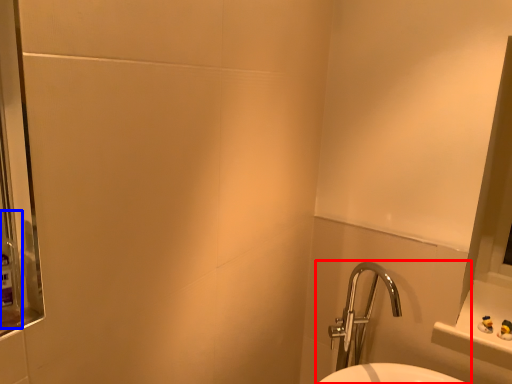
Question: Which object is further to the camera taking this photo, sink (highlighted by a red box) or mouthwash (highlighted by a blue box)?

Choices:
 (A) sink
 (B) mouthwash

Answer: (A)